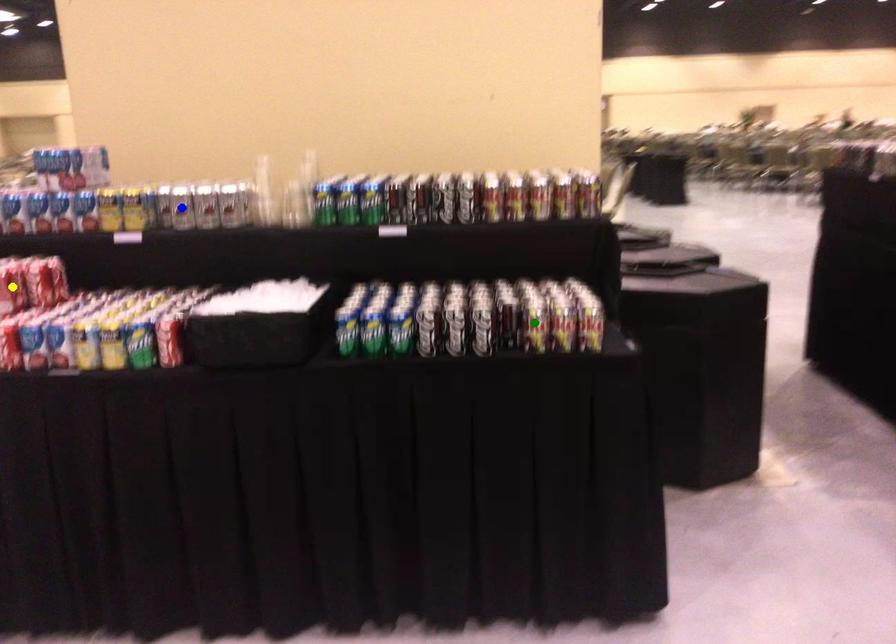
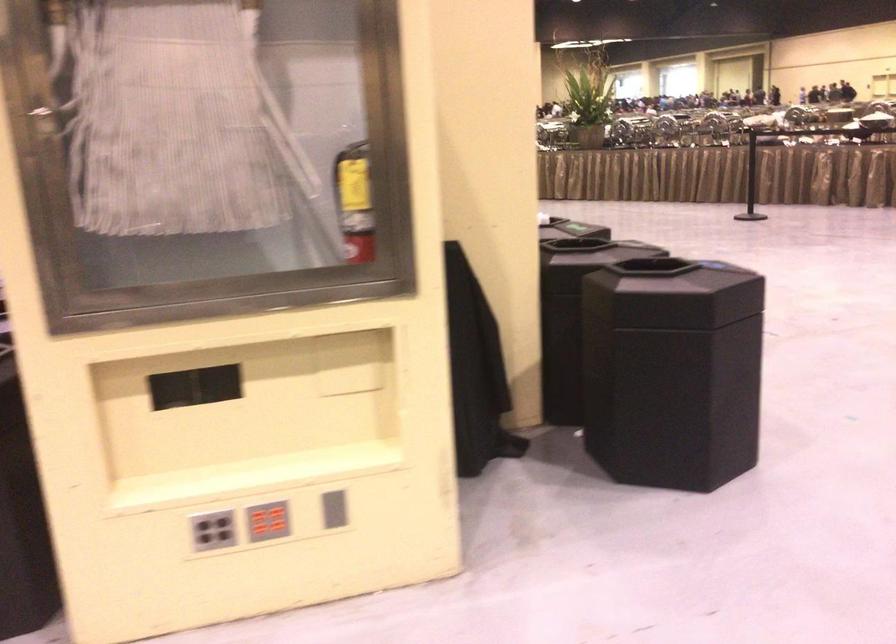
I am providing you with two images of the same scene from different viewpoints. Three points are marked in image1. Which point corresponds to a part or object that is occluded in image2?In image1, three points are marked. Which of them correspond to a part or object that is occluded in image2?Among the three points shown in image1, which one corresponds to a part or object that is no longer visible due to occlusion in image2?

blue point, yellow point, green point cannot be seen in image2.